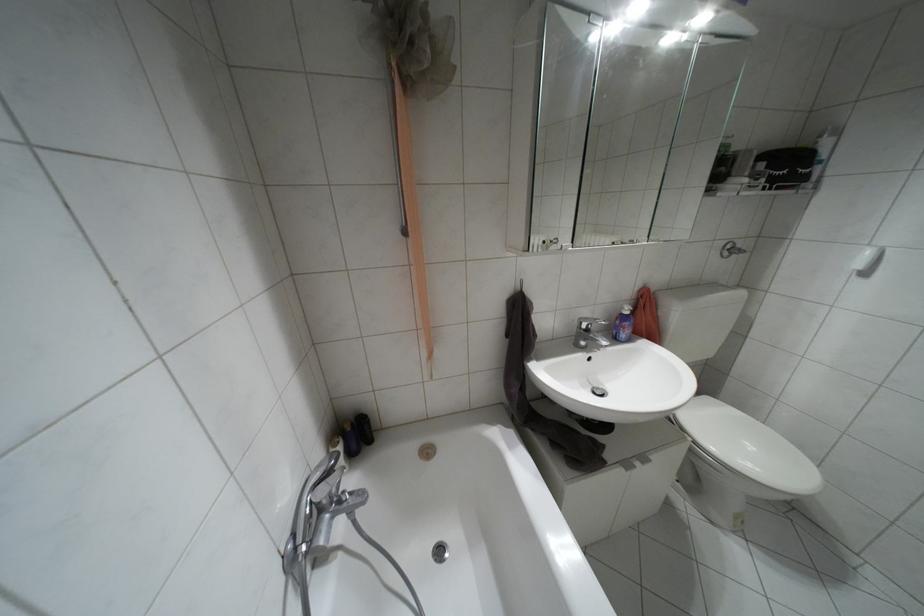
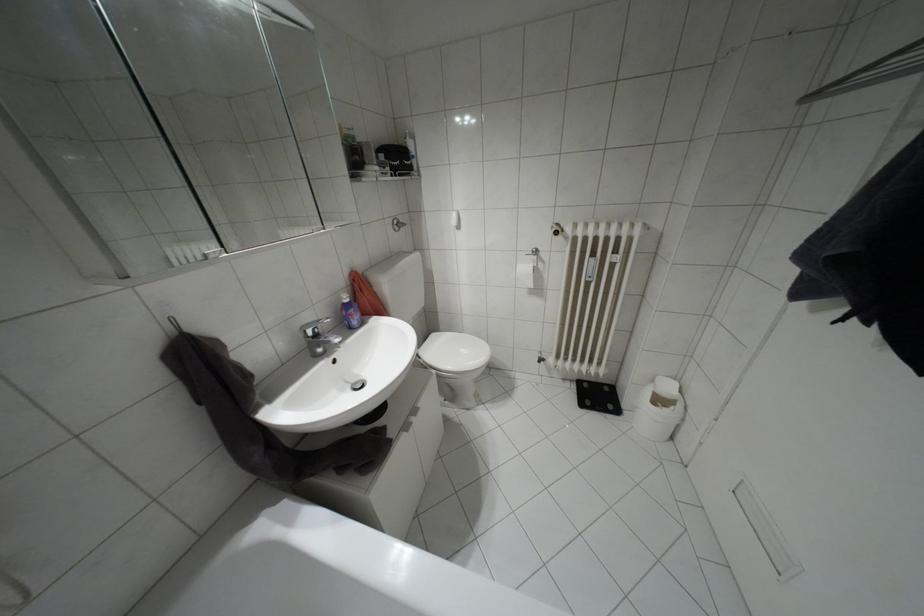
Where in the second image is the point corresponding to pixel 706 398 from the first image?

(432, 334)